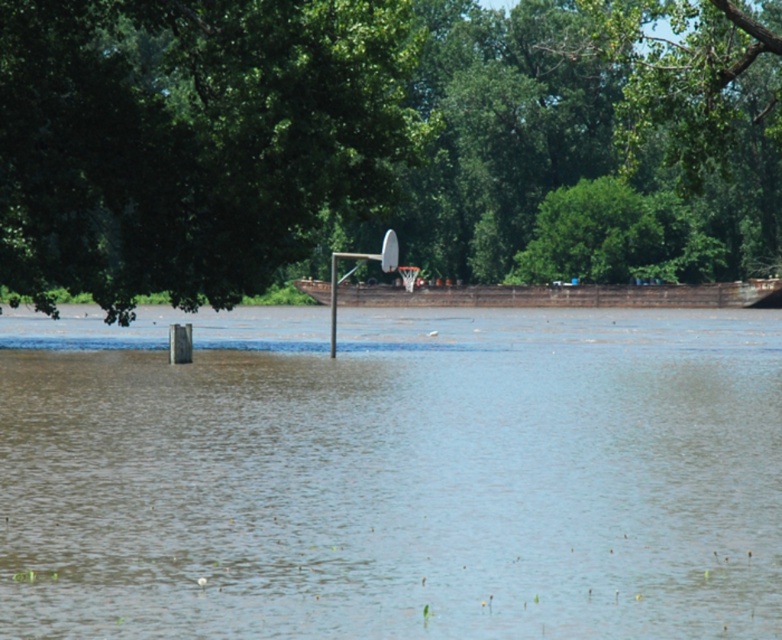
Question: Which point is farther to the camera?

Choices:
 (A) brown muddy water at center
 (B) green leafy tree at upper center
 (C) metallic silver basketball hoop at center

Answer: (C)

Question: Does brown muddy water at center have a smaller size compared to green leafy tree at upper left?

Choices:
 (A) no
 (B) yes

Answer: (B)

Question: Is green leafy tree at upper left to the right of green leafy tree at upper center from the viewer's perspective?

Choices:
 (A) no
 (B) yes

Answer: (A)

Question: Which of the following is the farthest from the observer?

Choices:
 (A) green leafy tree at upper center
 (B) metallic silver basketball hoop at center

Answer: (B)

Question: From the image, what is the correct spatial relationship of brown muddy water at center in relation to green leafy tree at upper center?

Choices:
 (A) above
 (B) below

Answer: (B)

Question: Which object appears closest to the camera in this image?

Choices:
 (A) metallic silver basketball hoop at center
 (B) green leafy tree at upper center
 (C) green leafy tree at upper left
 (D) brown muddy water at center

Answer: (D)